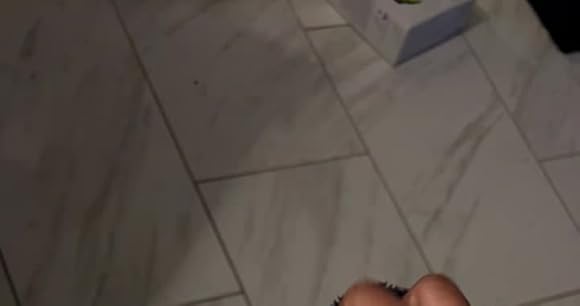
Locate an element on the screen. grout is located at coordinates (415, 241), (558, 296), (553, 155), (541, 164), (313, 26), (215, 178), (186, 161), (8, 284), (230, 292).